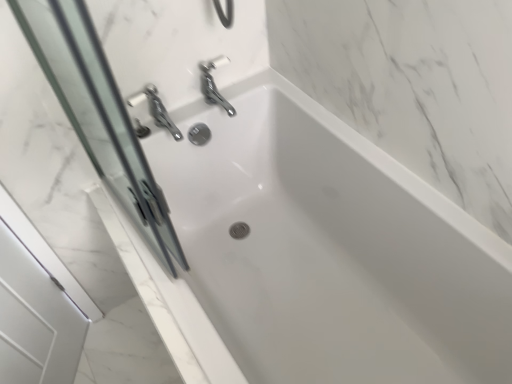
Question: From their relative heights in the image, would you say white glossy bathtub at center is taller or shorter than transparent glass screen door at left?

Choices:
 (A) short
 (B) tall

Answer: (A)

Question: Considering the positions of white glossy bathtub at center and transparent glass screen door at left in the image, is white glossy bathtub at center wider or thinner than transparent glass screen door at left?

Choices:
 (A) thin
 (B) wide

Answer: (B)

Question: From a real-world perspective, is white glossy bathtub at center physically located above or below transparent glass screen door at left?

Choices:
 (A) below
 (B) above

Answer: (A)

Question: Is transparent glass screen door at left taller or shorter than white glossy bathtub at center?

Choices:
 (A) tall
 (B) short

Answer: (A)

Question: In terms of size, does transparent glass screen door at left appear bigger or smaller than white glossy bathtub at center?

Choices:
 (A) big
 (B) small

Answer: (B)

Question: Considering the relative positions of transparent glass screen door at left and white glossy bathtub at center in the image provided, is transparent glass screen door at left to the left or to the right of white glossy bathtub at center?

Choices:
 (A) right
 (B) left

Answer: (B)

Question: From the image's perspective, relative to white glossy bathtub at center, is transparent glass screen door at left above or below?

Choices:
 (A) below
 (B) above

Answer: (B)